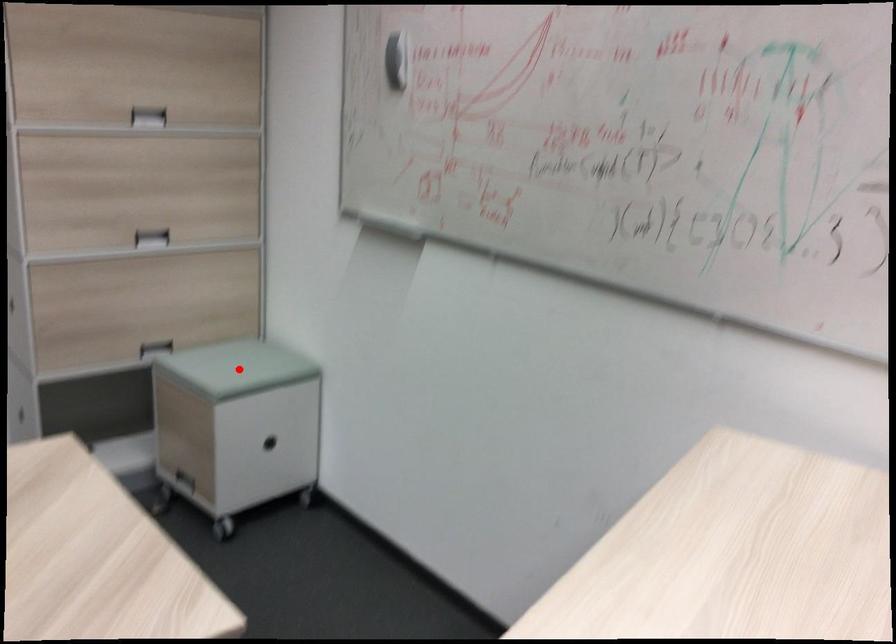
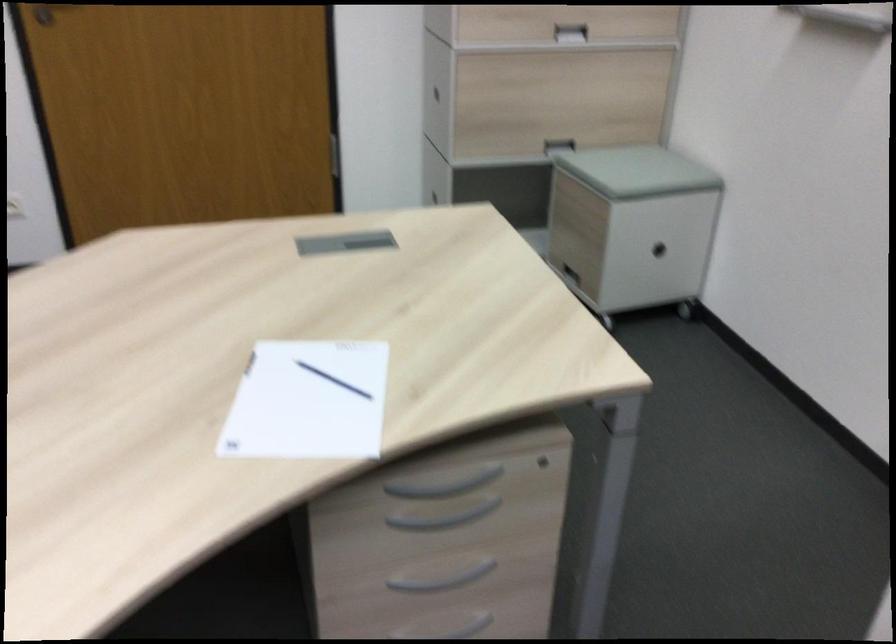
The point at the highlighted location is marked in the first image. Where is the corresponding point in the second image?

(638, 171)